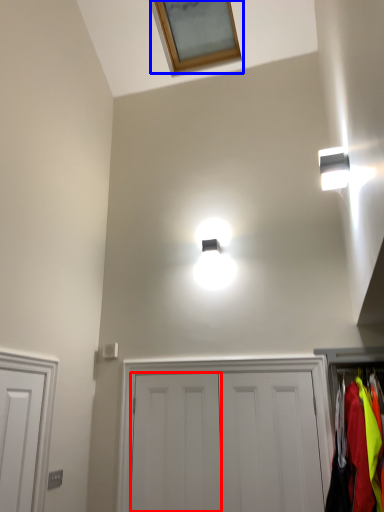
Question: Which point is further to the camera, door (highlighted by a red box) or window (highlighted by a blue box)?

Choices:
 (A) door
 (B) window

Answer: (B)